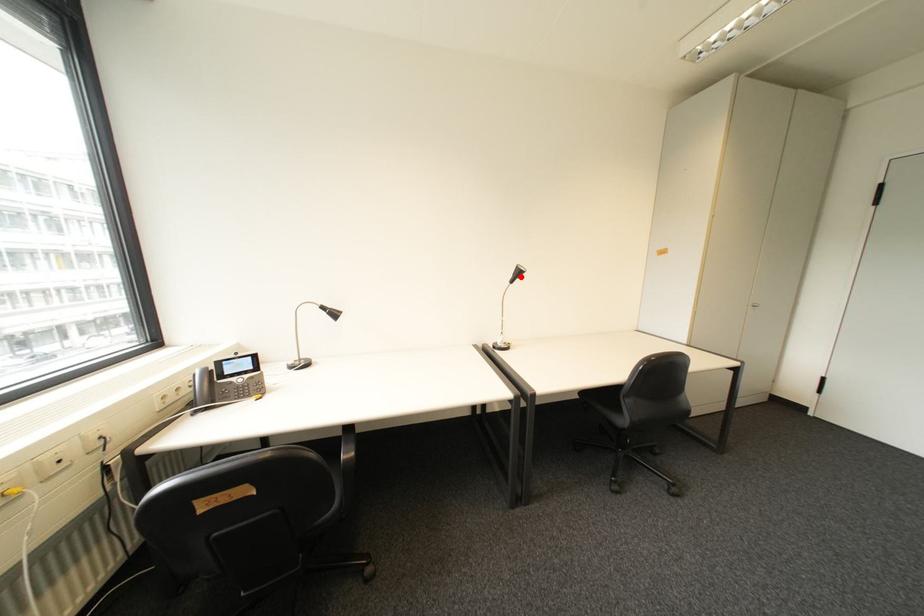
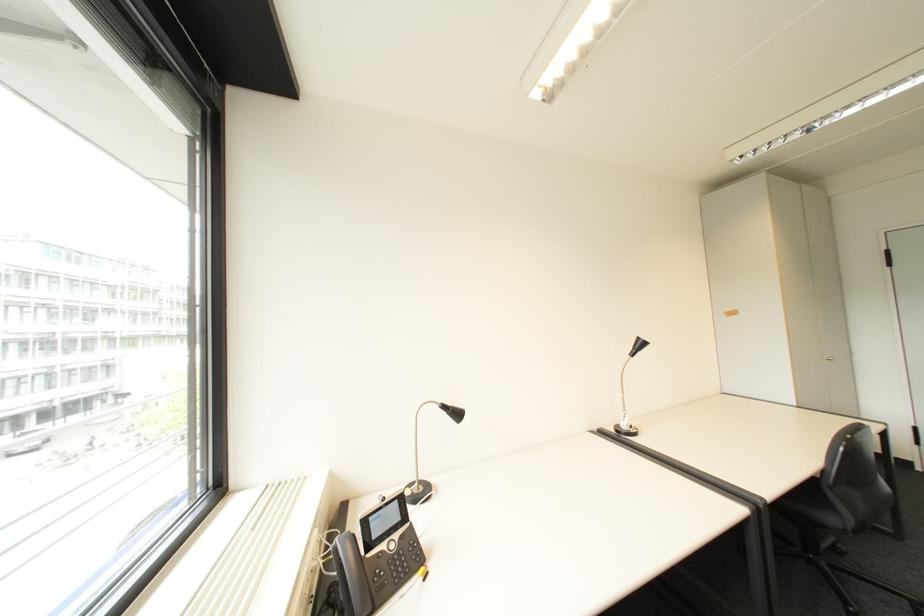
In the second image, find the point that corresponds to the highlighted location in the first image.

(640, 350)